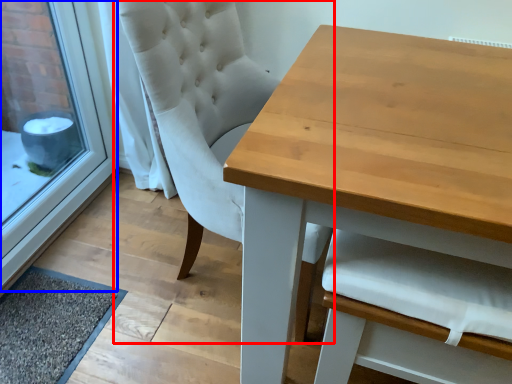
Question: Among these objects, which one is farthest to the camera, chair (highlighted by a red box) or window frame (highlighted by a blue box)?

Choices:
 (A) chair
 (B) window frame

Answer: (B)